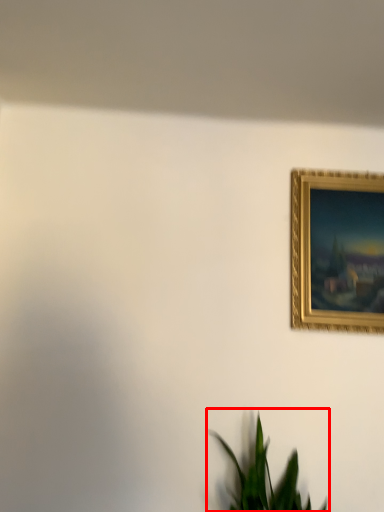
Question: From the image's perspective, considering the relative positions of houseplant (annotated by the red box) and picture frame in the image provided, where is houseplant (annotated by the red box) located with respect to the staircase?

Choices:
 (A) below
 (B) above

Answer: (A)